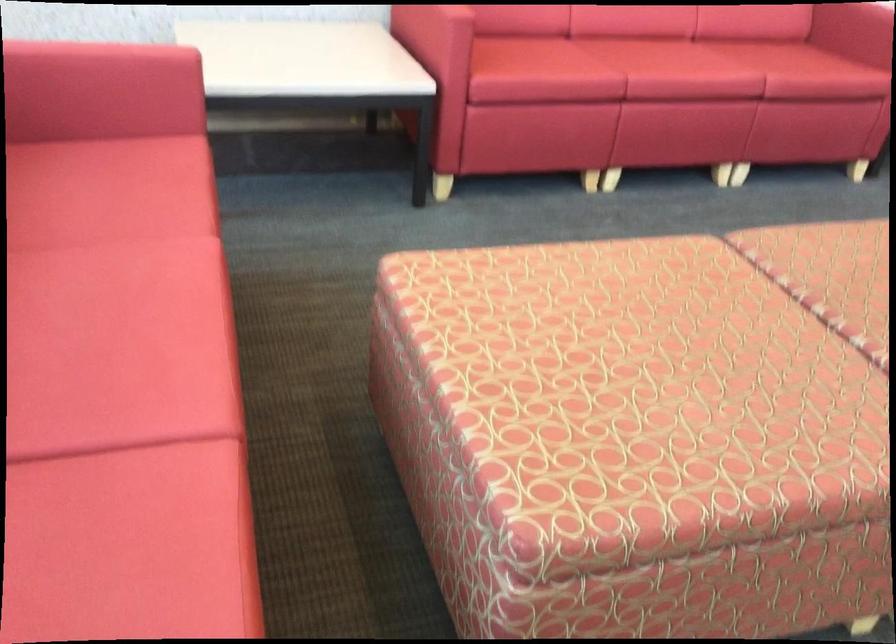
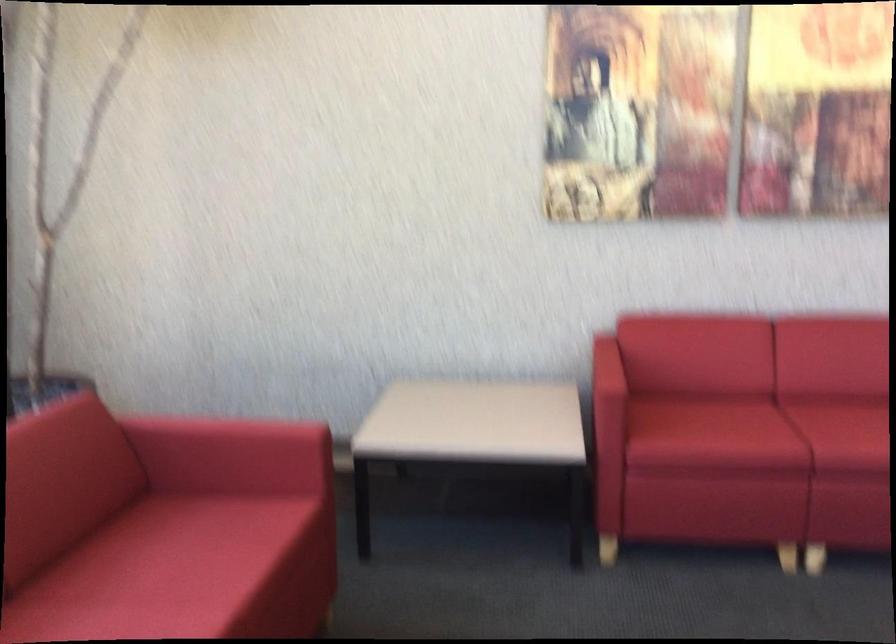
In the second image, find the point that corresponds to point (104, 192) in the first image.

(195, 547)